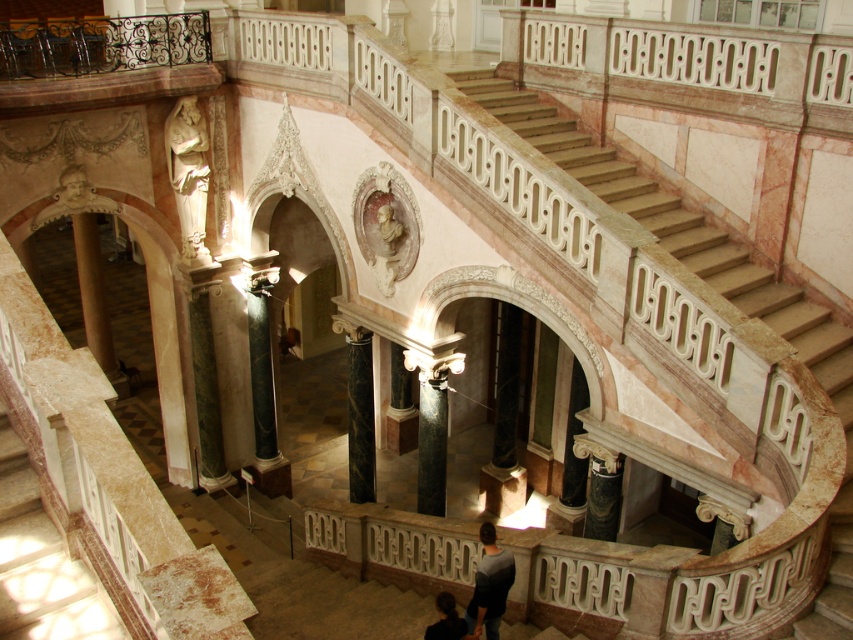
You are standing in the grand hall and notice a green marble pillar at lower left and a dark gray sweater at lower center. Which object is located higher in the scene?

The green marble pillar at lower left is positioned over the dark gray sweater at lower center, so it is higher in the scene.

You are an interior designer assessing the space for a new sculpture. The sculpture will be placed between the green marble pillar at lower left and the dark gray sweater at lower center. Which object should the sculpture be placed closer to in order to maintain visual balance, considering their heights?

The sculpture should be placed closer to the dark gray sweater at lower center because the green marble pillar at lower left is taller, so placing the sculpture closer to the shorter object balances the composition.